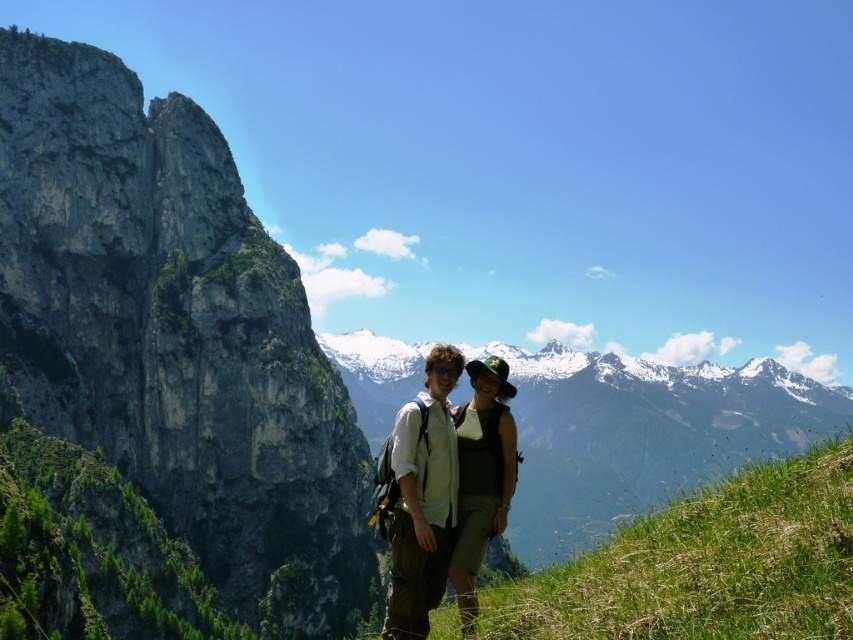
Question: Is green grassy hillside at left in front of green grassy hillside at lower right?

Choices:
 (A) no
 (B) yes

Answer: (A)

Question: Which object is the closest to the green grassy hillside at left?

Choices:
 (A) matte white shirt at center
 (B) green grassy hillside at lower right

Answer: (A)

Question: Which point is farther from the camera taking this photo?

Choices:
 (A) (474, 595)
 (B) (453, 371)
 (C) (91, 465)
 (D) (775, 552)

Answer: (C)

Question: Can you confirm if green grassy hillside at left is positioned above green grassy hillside at lower right?

Choices:
 (A) yes
 (B) no

Answer: (A)

Question: Among these points, which one is farthest from the camera?

Choices:
 (A) (479, 452)
 (B) (682, 516)
 (C) (494, 493)

Answer: (A)

Question: Is green grassy hillside at left to the right of green fabric hat at center from the viewer's perspective?

Choices:
 (A) no
 (B) yes

Answer: (A)